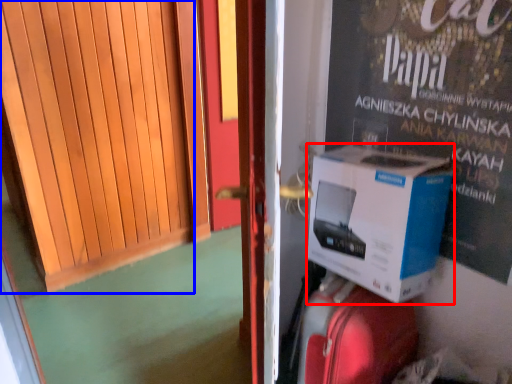
Question: Among these objects, which one is nearest to the camera, box (highlighted by a red box) or door (highlighted by a blue box)?

Choices:
 (A) box
 (B) door

Answer: (B)